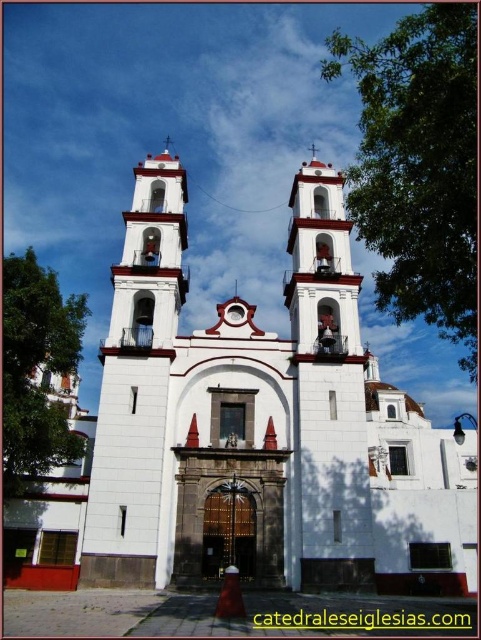
Is white stucco church at center taller than white stucco bell tower at center?

Yes.

Where is `white stucco church at center`? Image resolution: width=481 pixels, height=640 pixels. white stucco church at center is located at coordinates (248, 432).

What are the coordinates of `white stucco church at center` in the screenshot? It's located at (248, 432).